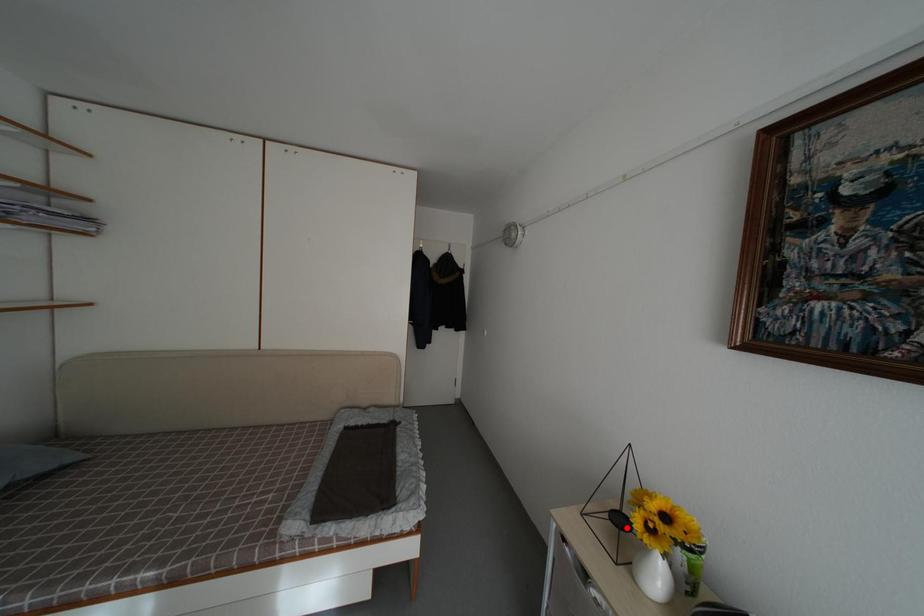
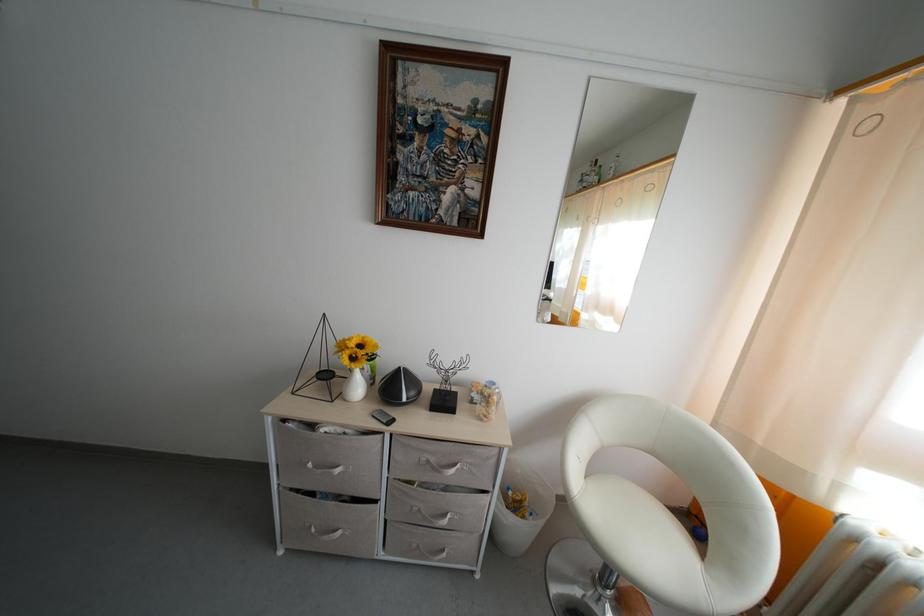
Find the pixel in the second image that matches the highlighted location in the first image.

(332, 382)